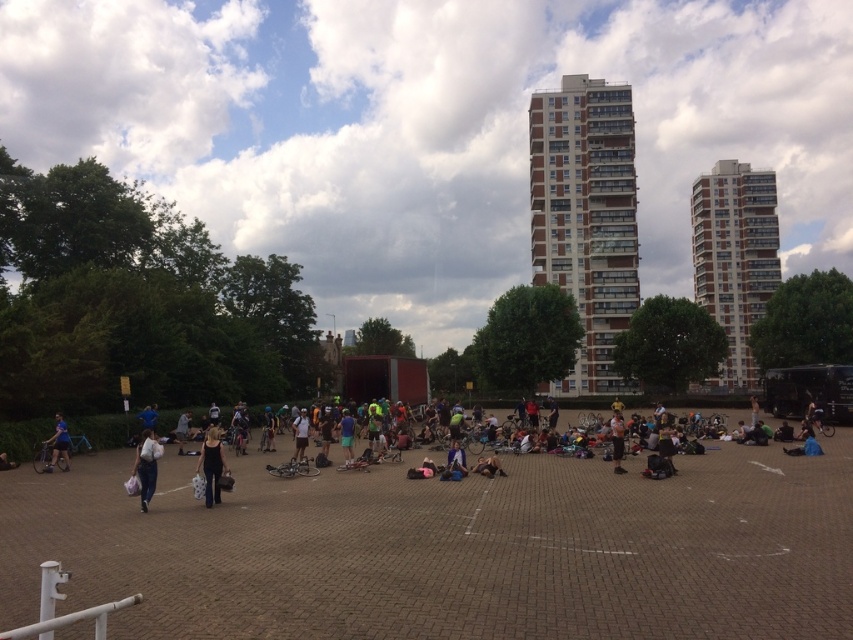
You are a photographer standing in the public square and notice a black matte tank top at center and a white fabric bag at center. Which item is positioned lower in the image?

The black matte tank top at center is positioned lower than the white fabric bag at center.

You are standing at the center of the public square and want to take a photo of both the point at coordinates point (213, 428) and the point at coordinates point (155, 468). Which point should you focus on first to ensure both are in the same frame?

You should focus on point (155, 468) first because it is closer to you than point (213, 428), which is further away. By focusing on the closer point, the depth of field may include both points in the same frame.

You are a photographer trying to capture a clear shot of both the black matte tank top at center and the white fabric bag at center. Since you want both items to be fully visible in your photo, which object should you focus on first to ensure proper depth of field?

The black matte tank top at center is shorter than the white fabric bag at center, so you should focus on the white fabric bag at center first to ensure both are in focus.